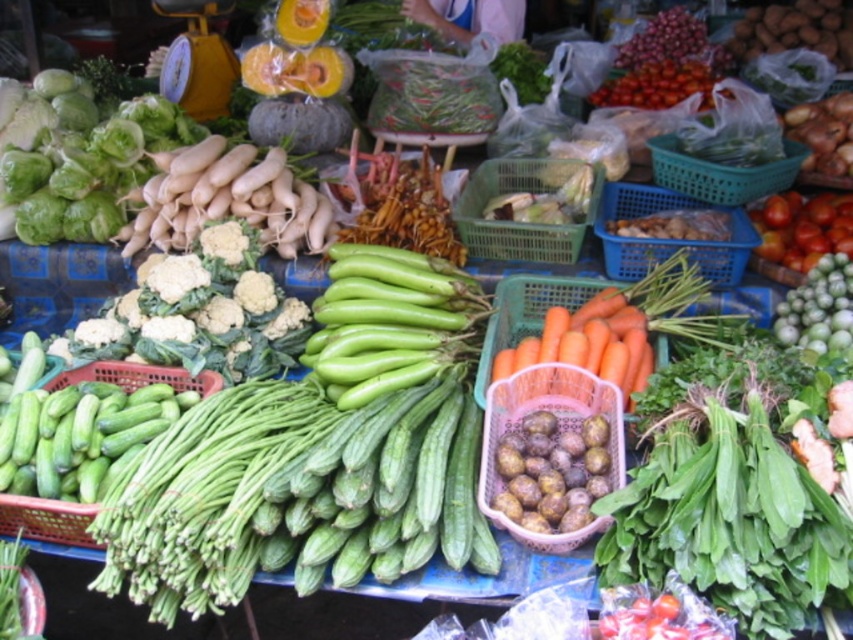
Question: Which point is farther to the camera?

Choices:
 (A) translucent plastic corn at center
 (B) green plastic basket at center
 (C) green plastic cucumbers at left
 (D) matte plastic basket at center right

Answer: (A)

Question: Does green matte eggplant at center come in front of ripe red tomato at upper right?

Choices:
 (A) no
 (B) yes

Answer: (B)

Question: Is blue plastic basket at center-right in front of green plastic basket at center?

Choices:
 (A) no
 (B) yes

Answer: (B)

Question: Which point is closer to the camera?

Choices:
 (A) matte plastic basket at center right
 (B) green matte eggplant at center

Answer: (A)

Question: Can you confirm if matte plastic basket at center right is positioned above ripe red tomato at upper right?

Choices:
 (A) no
 (B) yes

Answer: (A)

Question: Which object appears farthest from the camera in this image?

Choices:
 (A) matte plastic basket at center right
 (B) green matte eggplant at center
 (C) blue plastic basket at center-right
 (D) translucent plastic corn at center

Answer: (D)